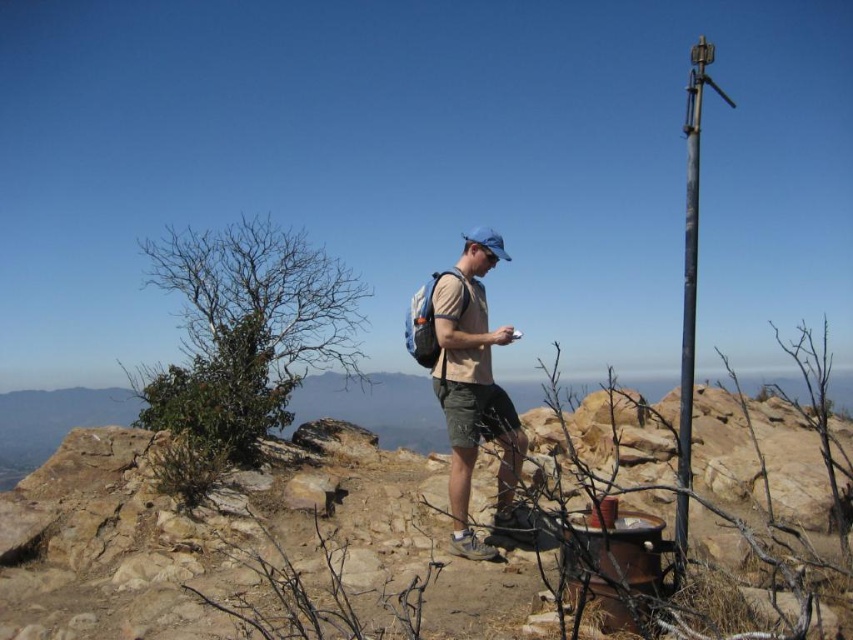
You are a hiker trying to set up a campsite. You have a tan fabric shirt at center and a dark gray metallic pole at right. Which item is closer to your left side?

The tan fabric shirt at center is positioned on the left side of dark gray metallic pole at right, so the tan fabric shirt at center is closer to your left side.

You are the hiker in the scene. You need to move from your current position to the dark gray metallic pole at right. Which direction should you go relative to the brown rocky hill at center?

The dark gray metallic pole at right is positioned above the brown rocky hill at center, so you should move upward towards the pole while navigating around the hill.